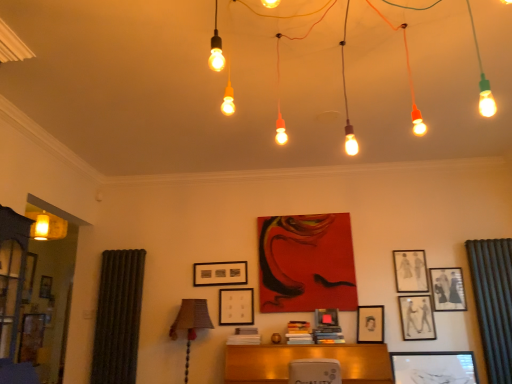
Question: Is matte black picture frame at upper right, the first picture frame from the right, positioned far away from matte black picture frame at center, the third picture frame from the left?

Choices:
 (A) yes
 (B) no

Answer: (A)

Question: From a real-world perspective, does matte black picture frame at upper right, the seventh picture frame positioned from the left, stand above matte black picture frame at center, the third picture frame from the left?

Choices:
 (A) no
 (B) yes

Answer: (B)

Question: Considering the relative sizes of matte black picture frame at upper right, the first picture frame from the right, and matte black picture frame at center, the third picture frame from the left, in the image provided, is matte black picture frame at upper right, the first picture frame from the right, thinner than matte black picture frame at center, the third picture frame from the left,?

Choices:
 (A) yes
 (B) no

Answer: (A)

Question: Is matte black picture frame at upper right, the first picture frame from the right, outside matte black picture frame at center, the 5th picture frame when ordered from right to left?

Choices:
 (A) yes
 (B) no

Answer: (A)

Question: Is matte black picture frame at upper right, the first picture frame from the right, positioned before matte black picture frame at center, the 5th picture frame when ordered from right to left?

Choices:
 (A) no
 (B) yes

Answer: (A)

Question: Can you confirm if matte black picture frame at upper right, the seventh picture frame positioned from the left, is positioned to the left of matte black picture frame at center, the 5th picture frame when ordered from right to left?

Choices:
 (A) no
 (B) yes

Answer: (A)

Question: Does matte black picture frame at center, the 5th picture frame when ordered from right to left, have a lesser height compared to matte black picture frame at upper right, the fifth picture frame viewed from the left?

Choices:
 (A) yes
 (B) no

Answer: (A)

Question: Is matte black picture frame at center, the 5th picture frame when ordered from right to left, positioned far away from matte black picture frame at upper right, the fifth picture frame viewed from the left?

Choices:
 (A) yes
 (B) no

Answer: (B)

Question: From a real-world perspective, does matte black picture frame at center, the third picture frame from the left, sit lower than matte black picture frame at upper right, the fifth picture frame viewed from the left?

Choices:
 (A) no
 (B) yes

Answer: (B)

Question: From a real-world perspective, is matte black picture frame at center, the third picture frame from the left, on top of matte black picture frame at upper right, the fifth picture frame viewed from the left?

Choices:
 (A) no
 (B) yes

Answer: (A)

Question: Considering the relative sizes of matte black picture frame at center, the third picture frame from the left, and matte black picture frame at upper right, which appears as the third picture frame when viewed from the right, in the image provided, is matte black picture frame at center, the third picture frame from the left, bigger than matte black picture frame at upper right, which appears as the third picture frame when viewed from the right,?

Choices:
 (A) no
 (B) yes

Answer: (A)

Question: Is matte black picture frame at center, the third picture frame from the left, positioned with its back to matte black picture frame at upper right, which appears as the third picture frame when viewed from the right?

Choices:
 (A) no
 (B) yes

Answer: (A)

Question: From the image's perspective, is matte black picture frame at center, the first picture frame when ordered from left to right, on top of matte black picture frame at center, the 5th picture frame when ordered from right to left?

Choices:
 (A) no
 (B) yes

Answer: (B)